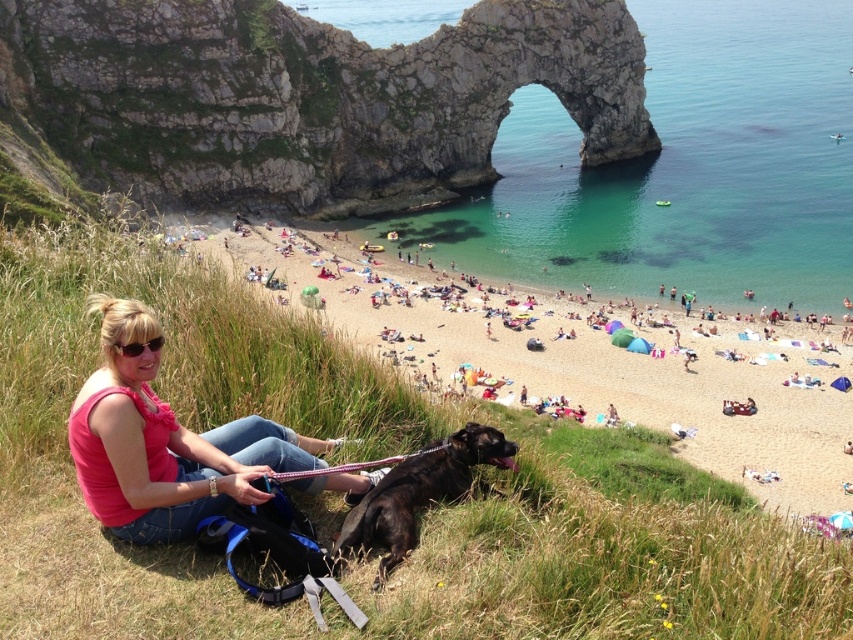
Can you confirm if rugged stone arch at center is smaller than pink fabric at lower left?

→ No.

Is rugged stone arch at center positioned before pink fabric at lower left?

No, it is not.

Who is more forward, (210, 104) or (165, 472)?

Point (165, 472) is more forward.

Locate an element on the screen. Image resolution: width=853 pixels, height=640 pixels. rugged stone arch at center is located at coordinates (305, 99).

Looking at this image, does rugged stone arch at center appear under beige sand beach at lower center?

No.

Between rugged stone arch at center and beige sand beach at lower center, which one has more height?

With more height is rugged stone arch at center.

Describe the element at coordinates (305, 99) in the screenshot. I see `rugged stone arch at center` at that location.

Locate an element on the screen. rugged stone arch at center is located at coordinates click(305, 99).

Between rugged stone arch at center and shiny black dog at lower center, which one has more height?

rugged stone arch at center

How distant is rugged stone arch at center from shiny black dog at lower center?

rugged stone arch at center is 78.49 meters away from shiny black dog at lower center.

Does point (442, 88) lie in front of point (469, 456)?

No, it is behind (469, 456).

Locate an element on the screen. The width and height of the screenshot is (853, 640). rugged stone arch at center is located at coordinates (305, 99).